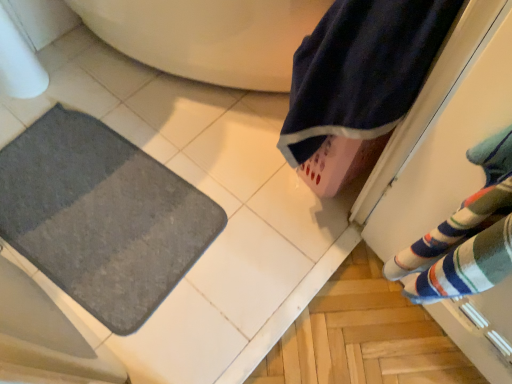
Find the location of a particular element. Image resolution: width=512 pixels, height=384 pixels. navy blue towel at upper right is located at coordinates (361, 70).

What do you see at coordinates (361, 70) in the screenshot? I see `navy blue towel at upper right` at bounding box center [361, 70].

I want to click on gray soft mat at lower left, so click(x=101, y=216).

Describe the element at coordinates (101, 216) in the screenshot. I see `gray soft mat at lower left` at that location.

Locate an element on the screen. navy blue towel at upper right is located at coordinates (361, 70).

Based on their positions, is navy blue towel at upper right located to the left or right of gray soft mat at lower left?

In the image, navy blue towel at upper right appears on the right side of gray soft mat at lower left.

Between navy blue towel at upper right and gray soft mat at lower left, which one is positioned in front?

navy blue towel at upper right.

Is point (361, 42) positioned in front of point (188, 235)?

Yes, point (361, 42) is in front of point (188, 235).

From the image's perspective, is navy blue towel at upper right above or below gray soft mat at lower left?

From the image's perspective, navy blue towel at upper right appears above gray soft mat at lower left.

From a real-world perspective, is navy blue towel at upper right physically below gray soft mat at lower left?

No, from a real-world perspective, navy blue towel at upper right is not below gray soft mat at lower left.

Between navy blue towel at upper right and gray soft mat at lower left, which one has larger width?

With larger width is gray soft mat at lower left.

Considering the sizes of objects navy blue towel at upper right and gray soft mat at lower left in the image provided, who is taller, navy blue towel at upper right or gray soft mat at lower left?

With more height is navy blue towel at upper right.

Considering the sizes of objects navy blue towel at upper right and gray soft mat at lower left in the image provided, who is smaller, navy blue towel at upper right or gray soft mat at lower left?

With smaller size is gray soft mat at lower left.

Is gray soft mat at lower left surrounded by navy blue towel at upper right?

No, gray soft mat at lower left is not inside navy blue towel at upper right.

Are navy blue towel at upper right and gray soft mat at lower left located far from each other?

They are positioned close to each other.

Is gray soft mat at lower left at the back of navy blue towel at upper right?

No, navy blue towel at upper right is not facing the opposite direction of gray soft mat at lower left.

What's the angular difference between navy blue towel at upper right and gray soft mat at lower left's facing directions?

navy blue towel at upper right and gray soft mat at lower left are facing 88 degrees away from each other.

Identify the location of bath mat below the navy blue towel at upper right (from a real-world perspective). The image size is (512, 384). (101, 216).

Considering the relative positions of gray soft mat at lower left and navy blue towel at upper right in the image provided, is gray soft mat at lower left to the left of navy blue towel at upper right from the viewer's perspective?

Yes, gray soft mat at lower left is to the left of navy blue towel at upper right.

Is gray soft mat at lower left positioned in front of navy blue towel at upper right?

No, it is not.

Which is closer, (145,194) or (397,8)?

Point (145,194) appears to be farther away from the viewer than point (397,8).

From the image's perspective, is gray soft mat at lower left under navy blue towel at upper right?

Indeed, from the image's perspective, gray soft mat at lower left is shown beneath navy blue towel at upper right.

From a real-world perspective, which object rests below the other?

gray soft mat at lower left is physically lower.

Considering the sizes of objects gray soft mat at lower left and navy blue towel at upper right in the image provided, who is thinner, gray soft mat at lower left or navy blue towel at upper right?

With smaller width is navy blue towel at upper right.

Can you confirm if gray soft mat at lower left is taller than navy blue towel at upper right?

No, gray soft mat at lower left is not taller than navy blue towel at upper right.

In the scene shown: Is gray soft mat at lower left bigger than navy blue towel at upper right?

Actually, gray soft mat at lower left might be smaller than navy blue towel at upper right.

Is gray soft mat at lower left inside the boundaries of navy blue towel at upper right, or outside?

gray soft mat at lower left cannot be found inside navy blue towel at upper right.

Is gray soft mat at lower left in contact with navy blue towel at upper right?

No.

Does gray soft mat at lower left turn towards navy blue towel at upper right?

No, gray soft mat at lower left is not aimed at navy blue towel at upper right.

The image size is (512, 384). In order to click on bath mat behind the navy blue towel at upper right in this screenshot , I will do `click(101, 216)`.

Image resolution: width=512 pixels, height=384 pixels. I want to click on bath mat below the navy blue towel at upper right (from a real-world perspective), so click(101, 216).

Find the location of a particular element. This screenshot has width=512, height=384. beach towel located in front of the gray soft mat at lower left is located at coordinates (361, 70).